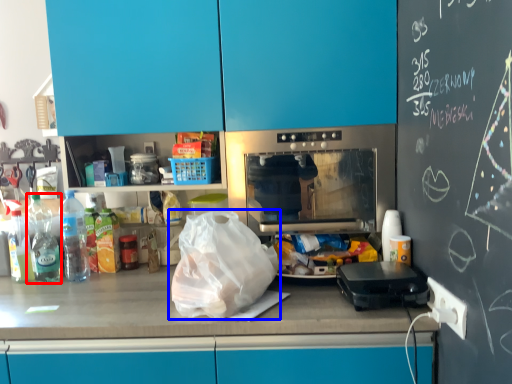
Question: Which of the following is the closest to the observer, bottle (highlighted by a red box) or plastic bag (highlighted by a blue box)?

Choices:
 (A) bottle
 (B) plastic bag

Answer: (B)